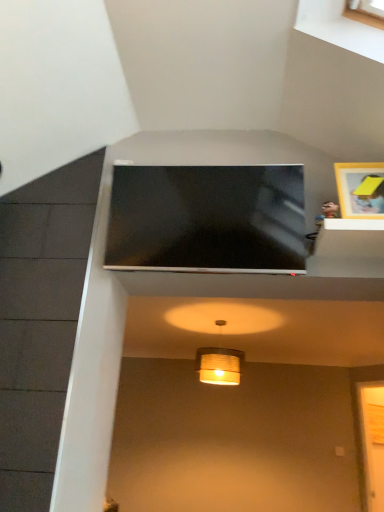
Question: Is matte yellow paper lampshade at center positioned with its back to matte black tv at upper center?

Choices:
 (A) yes
 (B) no

Answer: (B)

Question: Does matte yellow paper lampshade at center appear on the left side of matte black tv at upper center?

Choices:
 (A) no
 (B) yes

Answer: (A)

Question: From the image's perspective, would you say matte yellow paper lampshade at center is shown under matte black tv at upper center?

Choices:
 (A) yes
 (B) no

Answer: (A)

Question: Is matte yellow paper lampshade at center aimed at matte black tv at upper center?

Choices:
 (A) no
 (B) yes

Answer: (B)

Question: Does matte yellow paper lampshade at center have a greater width compared to matte black tv at upper center?

Choices:
 (A) no
 (B) yes

Answer: (B)

Question: Is transparent glass door at lower right in front of or behind matte yellow paper lampshade at center in the image?

Choices:
 (A) front
 (B) behind

Answer: (B)

Question: Is transparent glass door at lower right bigger or smaller than matte yellow paper lampshade at center?

Choices:
 (A) small
 (B) big

Answer: (A)

Question: From a real-world perspective, is transparent glass door at lower right physically located above or below matte yellow paper lampshade at center?

Choices:
 (A) above
 (B) below

Answer: (B)

Question: Looking at their shapes, would you say transparent glass door at lower right is wider or thinner than matte yellow paper lampshade at center?

Choices:
 (A) wide
 (B) thin

Answer: (B)

Question: Considering the positions of point click(155, 266) and point click(367, 501), is point click(155, 266) closer or farther from the camera than point click(367, 501)?

Choices:
 (A) closer
 (B) farther

Answer: (A)

Question: Based on their positions, is matte black tv at upper center located to the left or right of transparent glass door at lower right?

Choices:
 (A) right
 (B) left

Answer: (B)

Question: Considering the positions of matte black tv at upper center and transparent glass door at lower right in the image, is matte black tv at upper center wider or thinner than transparent glass door at lower right?

Choices:
 (A) wide
 (B) thin

Answer: (A)

Question: Relative to transparent glass door at lower right, is matte black tv at upper center in front or behind?

Choices:
 (A) front
 (B) behind

Answer: (A)

Question: From a real-world perspective, is matte yellow paper lampshade at center positioned above or below matte black tv at upper center?

Choices:
 (A) above
 (B) below

Answer: (B)

Question: From the image's perspective, is matte yellow paper lampshade at center above or below matte black tv at upper center?

Choices:
 (A) below
 (B) above

Answer: (A)